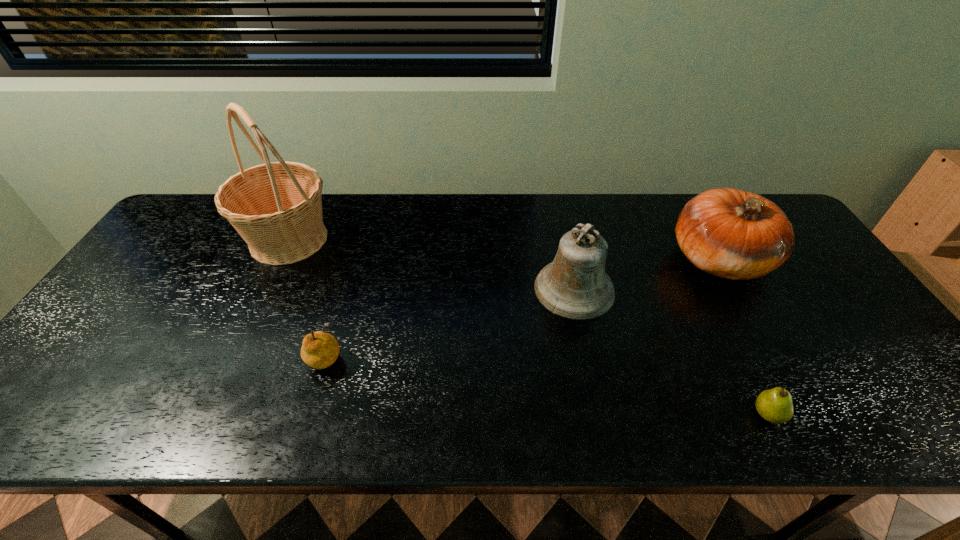
I want to click on vacant space at the left edge of the desktop, so click(x=178, y=276).

Where is `free space between the nearest object and the bell`? free space between the nearest object and the bell is located at coordinates 671,352.

Find the location of a particular element. free space between the pumpkin and the third object from left to right is located at coordinates (646, 274).

At what (x,y) coordinates should I click in order to perform the action: click on free spot between the pumpkin and the right pear. Please return your answer as a coordinate pair (x, y). Looking at the image, I should click on [743, 337].

Locate an element on the screen. This screenshot has width=960, height=540. free spot between the pumpkin and the nearer pear is located at coordinates (743, 337).

The image size is (960, 540). In order to click on vacant point located between the nearer pear and the bell in this screenshot , I will do `click(671, 352)`.

Locate an element on the screen. Image resolution: width=960 pixels, height=540 pixels. free space between the nearest object and the farther pear is located at coordinates (547, 384).

Where is `free space between the farther pear and the bell`? free space between the farther pear and the bell is located at coordinates (450, 322).

This screenshot has height=540, width=960. What are the coordinates of `empty location between the bell and the pumpkin` in the screenshot? It's located at (646, 274).

Identify the location of free space between the bell and the fourth farthest object. The image size is (960, 540). (450, 322).